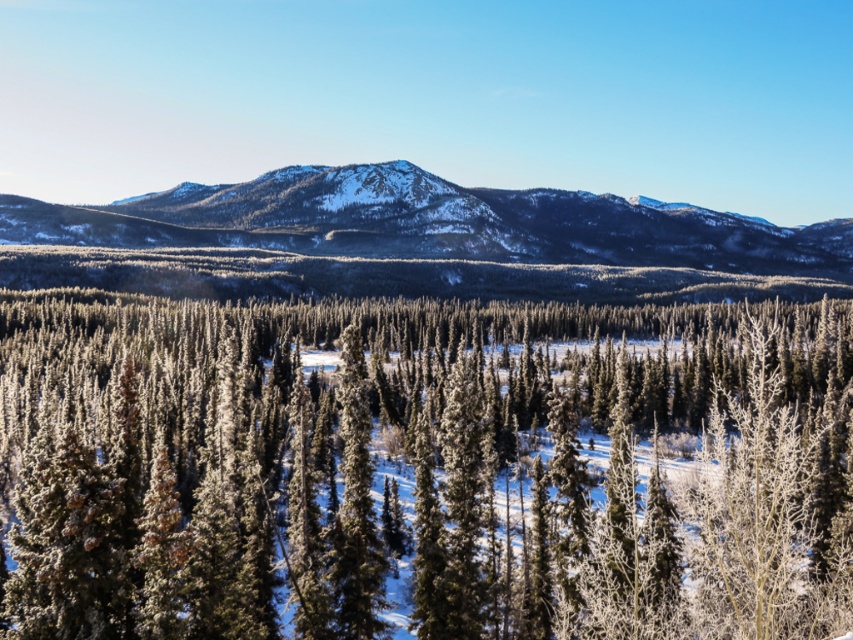
You are standing at the point marked by coordinates point (x=422, y=468) in the winter forest. Looking around, you notice a snowdrift to your immediate left and a small pine tree to your right. Which direction should you walk to reach the snowdrift?

Since the snowdrift is to your immediate left, you should walk to your left to reach it.